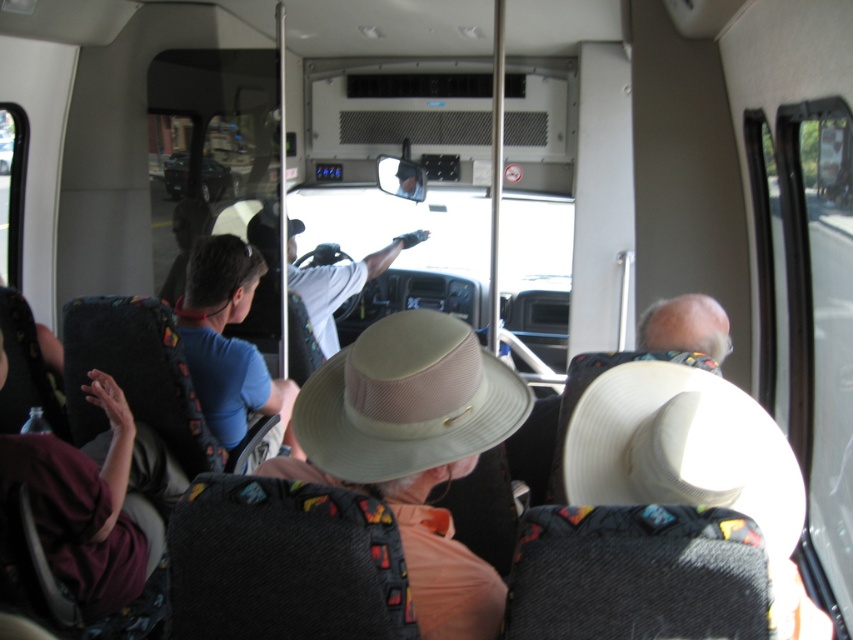
Consider the image. You are a passenger on the bus and want to know where the white woven cowboy hat at center is positioned relative to the front of the bus. Can you determine its location using coordinates?

The white woven cowboy hat at center is located at coordinates point (x=682, y=449), which places it towards the rear section of the bus since lower y coordinates indicate positions closer to the front. Therefore, it is positioned near the back.

You are a passenger on the bus and want to know where the beige fabric hat at center is located. Can you describe its position using coordinates?

The beige fabric hat at center is located at coordinates point (413, 449).